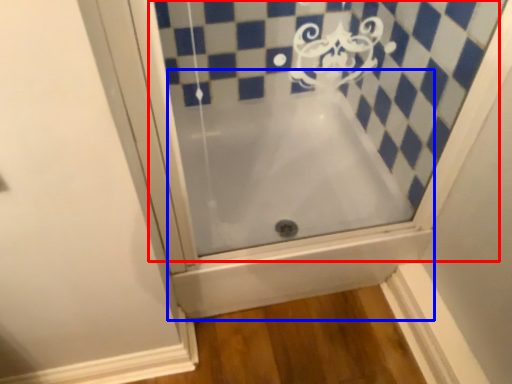
Question: Among these objects, which one is nearest to the camera, bath (highlighted by a red box) or bathtub (highlighted by a blue box)?

Choices:
 (A) bath
 (B) bathtub

Answer: (A)